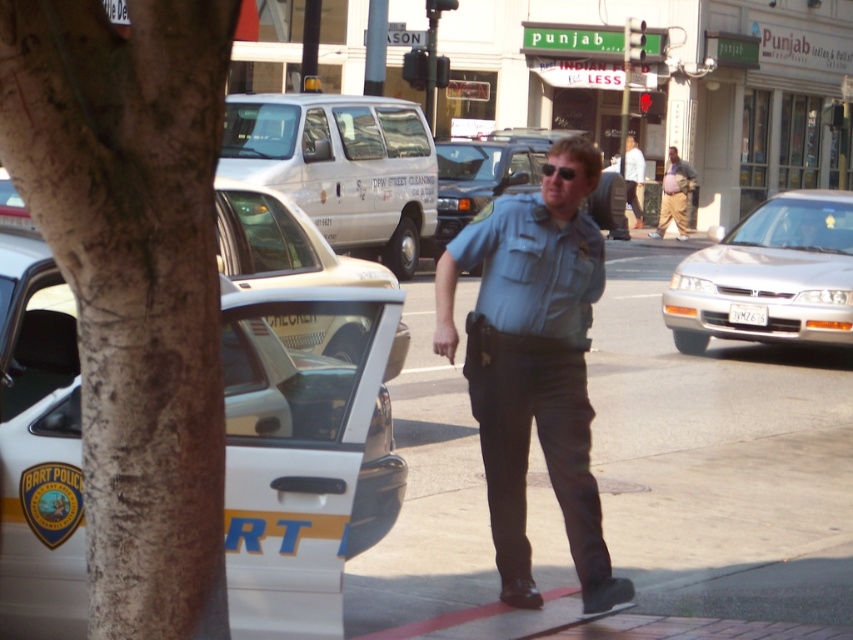
Based on the photo, between white glossy taxi at left and white matte van at center, which one is positioned higher?

Result: white matte van at center is above.

Can you confirm if white glossy taxi at left is wider than white matte van at center?

No.

Between point (28, 484) and point (251, 180), which one is positioned behind?

Positioned behind is point (251, 180).

Identify the location of white glossy taxi at left. (296, 449).

Can you confirm if smooth asphalt at center is positioned to the left of white shirt at center?

Yes, smooth asphalt at center is to the left of white shirt at center.

Which is in front, point (399, 388) or point (624, 157)?

Positioned in front is point (399, 388).

Where is `smooth asphalt at center`? The width and height of the screenshot is (853, 640). smooth asphalt at center is located at coordinates (718, 460).

Locate an element on the screen. This screenshot has width=853, height=640. smooth asphalt at center is located at coordinates (718, 460).

Does smooth asphalt at center appear on the right side of black plastic sunglasses at center?

Correct, you'll find smooth asphalt at center to the right of black plastic sunglasses at center.

Looking at this image, can you confirm if smooth asphalt at center is wider than black plastic sunglasses at center?

Yes.

Which is behind, point (611, 380) or point (577, 166)?

Point (611, 380)

The height and width of the screenshot is (640, 853). I want to click on smooth asphalt at center, so click(718, 460).